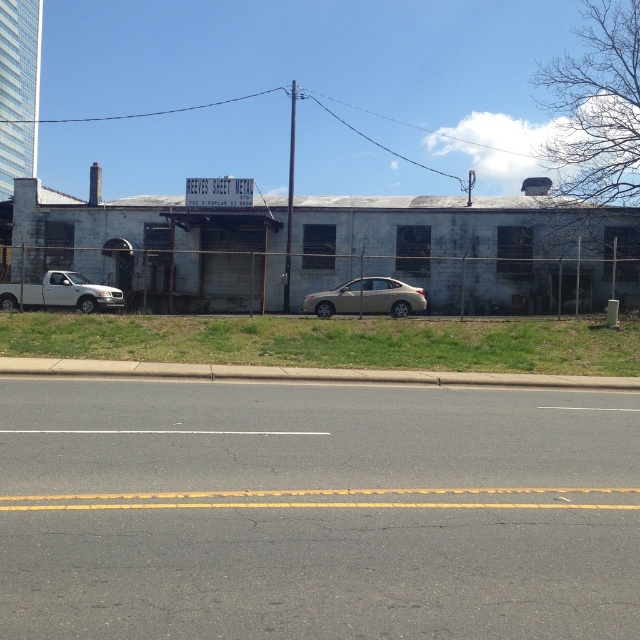
You are a delivery driver who needs to park your truck, which is 6 meters long, in the space between the satin silver sedan at center and the white matte truck at left. Can your truck fit in that space?

The distance between the satin silver sedan at center and the white matte truck at left is 7.23 meters. Since the truck is 6 meters long, it can fit in the space as there is enough length available.

What is the color and location of the object at point (332, 340)?

The object at point (332, 340) is green grass located at the lower center.

You are driving a car and see the satin silver sedan at center and the white matte truck at left. Which vehicle is positioned to the right of the other?

The satin silver sedan at center is to the right of the white matte truck at left.